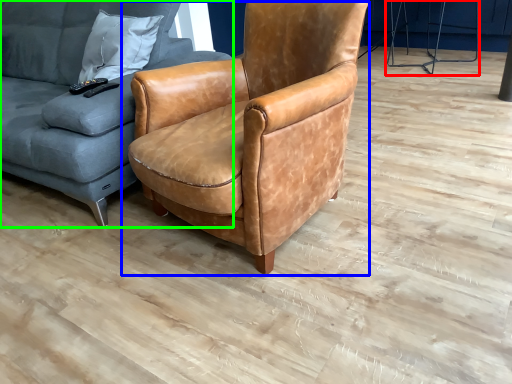
Question: Estimate the real-world distances between objects in this image. Which object is farther from half (highlighted by a red box), chair (highlighted by a blue box) or studio couch (highlighted by a green box)?

Choices:
 (A) chair
 (B) studio couch

Answer: (B)